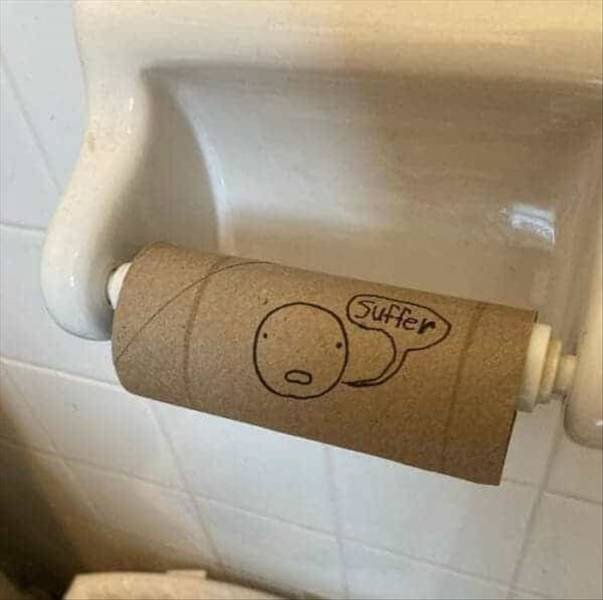
Identify the location of marker. Image resolution: width=603 pixels, height=600 pixels. (386, 333).